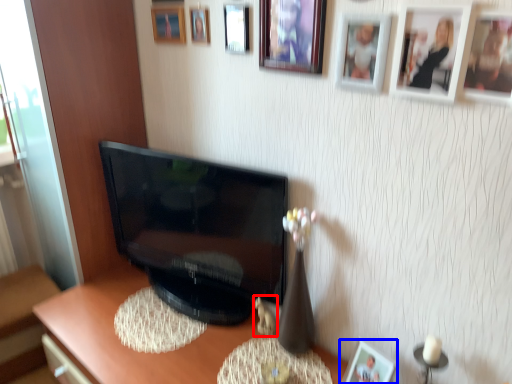
Question: Which object appears closest to the camera in this image, toy (highlighted by a red box) or picture frame (highlighted by a blue box)?

Choices:
 (A) toy
 (B) picture frame

Answer: (B)